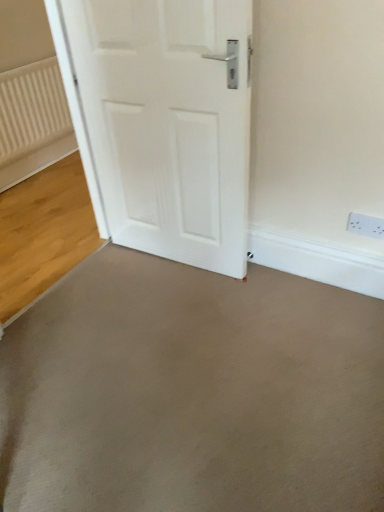
The width and height of the screenshot is (384, 512). In order to click on empty space that is ontop of white textured radiator at left (from a real-world perspective) in this screenshot , I will do `click(24, 61)`.